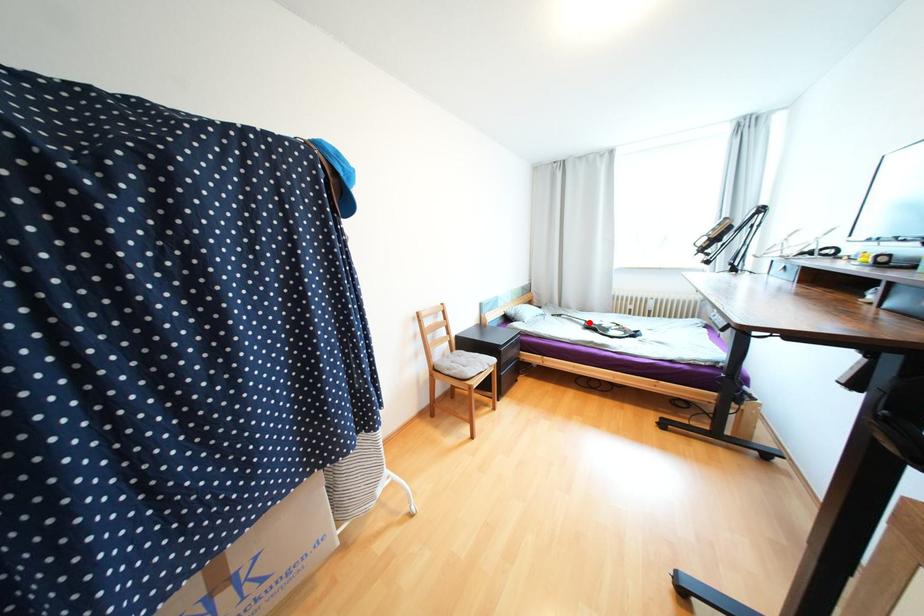
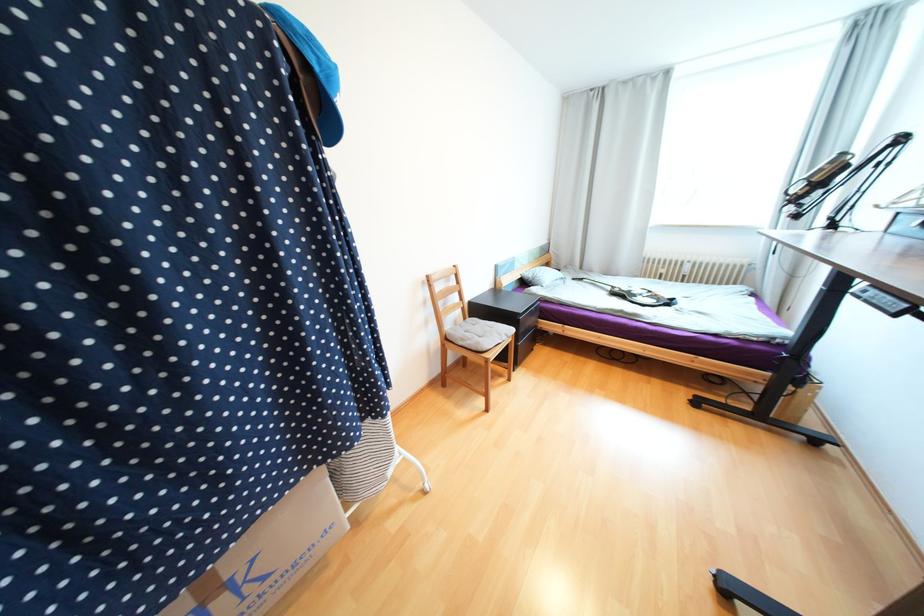
Where in the second image is the point corresponding to the highlighted location from the first image?

(614, 288)